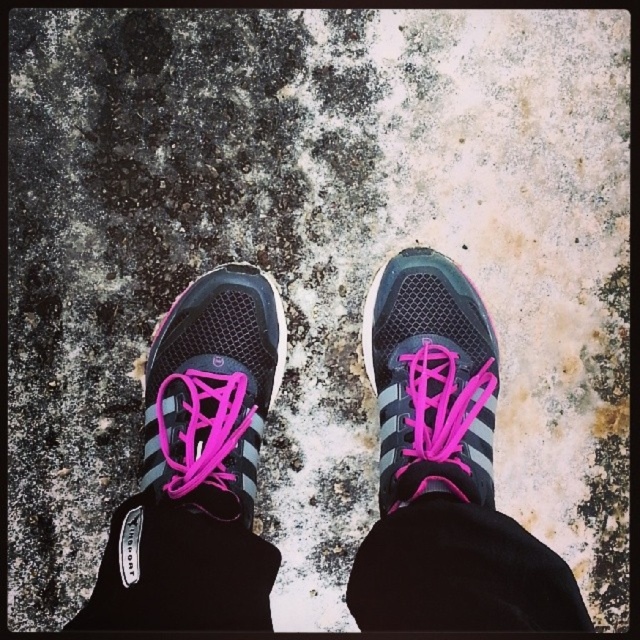
You are a photographer trying to capture both the matte black sneakers at center and the matte black shoe at center in a single shot. Since the camera can only focus on objects at the same distance, will you be able to focus on both?

The matte black sneakers at center is in front of the matte black shoe at center, so they are at different distances. Therefore, the camera cannot focus on both simultaneously.

You are a photographer trying to capture the texture of the ground. You notice two objects labeled as matte black sneakers at center and matte black sneaker at center. Which one is positioned lower in the image?

The matte black sneakers at center is positioned lower than the matte black sneaker at center because the description states that the sneakers are below the sneaker.

You are designing a custom insole for the matte black sneakers at center and the matte black sneaker at center. Since they are the same pair, will the insoles need to be the same size?

The distance between the matte black sneakers at center and the matte black sneaker at center is 3.42 inches, but since they are the same pair of shoes, the insoles should be the same size to fit both shoes properly.